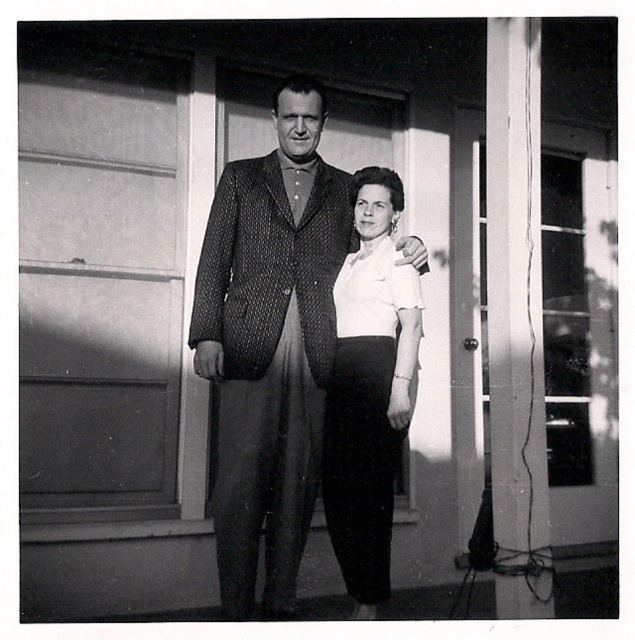
You are standing in front of the building shown in the image. The polka dot suit at center is part of a sculpture that you want to photograph. To get a clear shot, you need to be at least 2.5 meters away from the sculpture. Are you within the required distance?

The polka dot suit at center and viewer are 2.60 meters apart from each other, so yes, you are within the required distance of at least 2.5 meters to photograph the sculpture clearly.